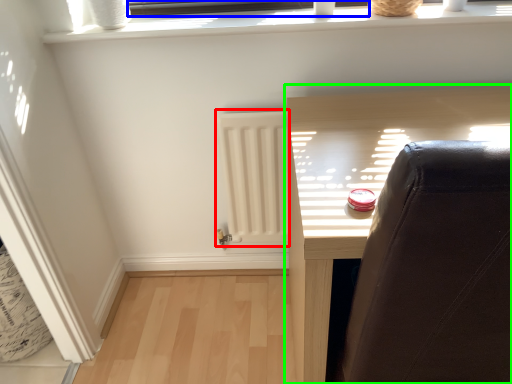
Question: Which is nearer to the radiator (highlighted by a red box)? window frame (highlighted by a blue box) or furniture (highlighted by a green box).

Choices:
 (A) window frame
 (B) furniture

Answer: (B)